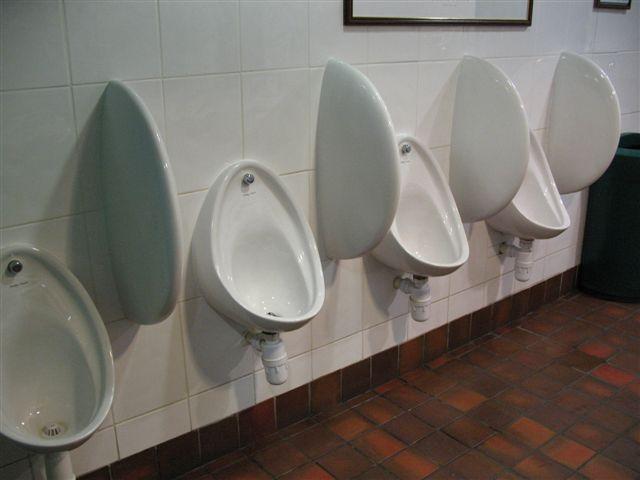
Where is `white tile wall`? Image resolution: width=640 pixels, height=480 pixels. white tile wall is located at coordinates (219, 368).